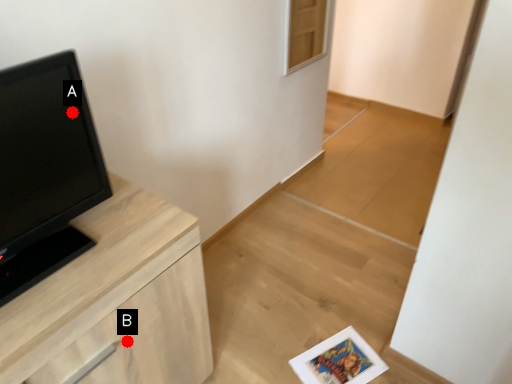
Question: Two points are circled on the image, labeled by A and B beside each circle. Which point is further to the camera?

Choices:
 (A) A is further
 (B) B is further

Answer: (B)